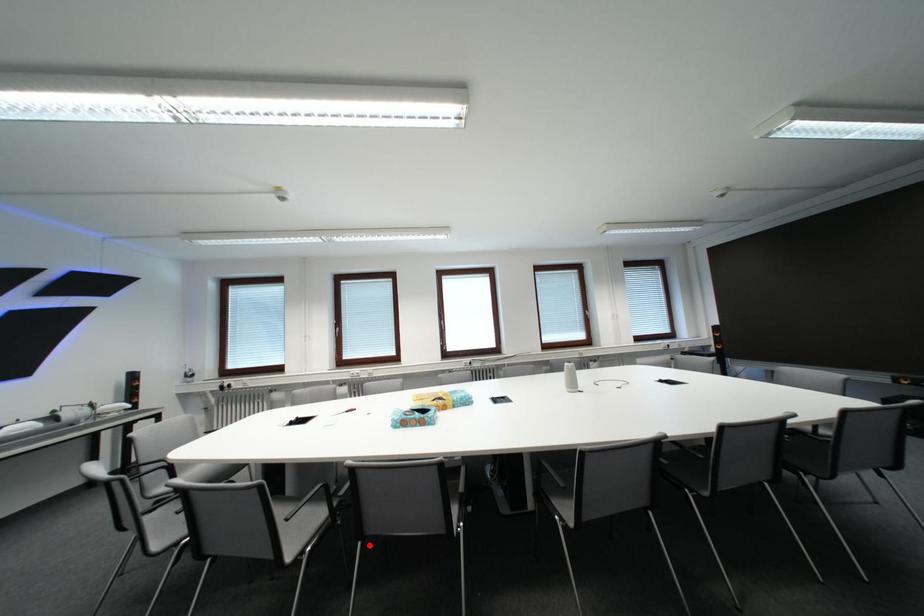
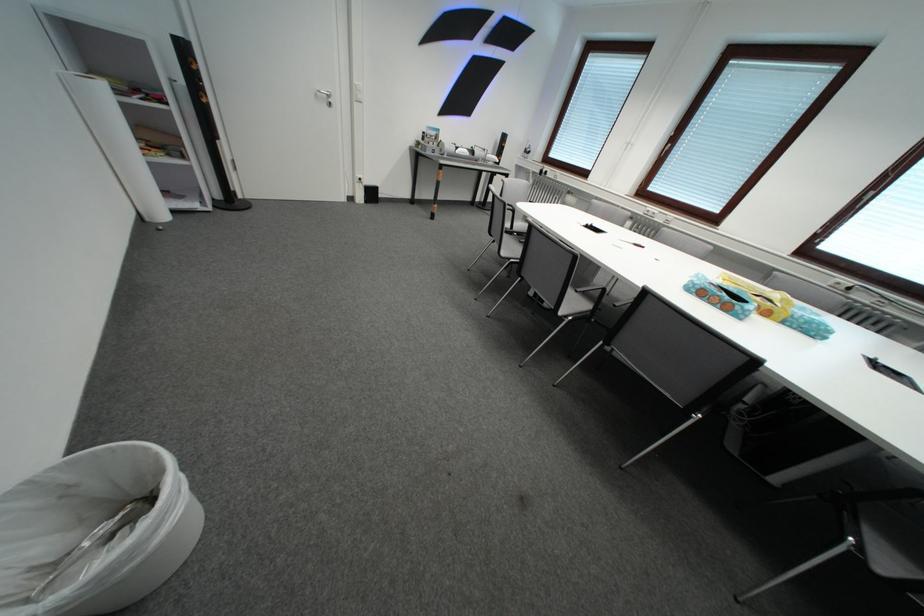
Question: I am providing you with two images of the same scene from different viewpoints. In image1, a red point is highlighted. Considering the same 3D point in image2, which of the following is correct?

Choices:
 (A) It is closer
 (B) It is farther

Answer: (A)